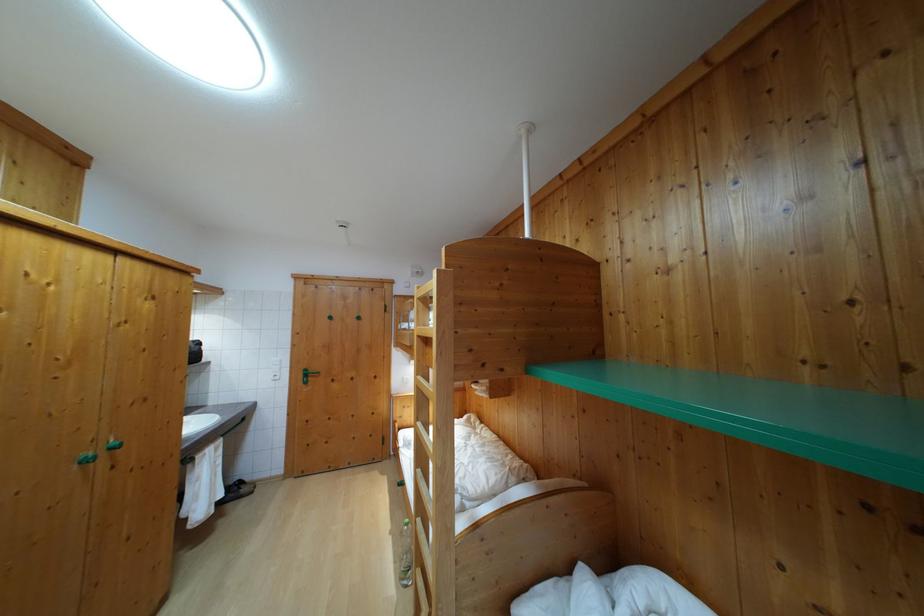
What do you see at coordinates (433, 446) in the screenshot?
I see `a bunk bed ladder` at bounding box center [433, 446].